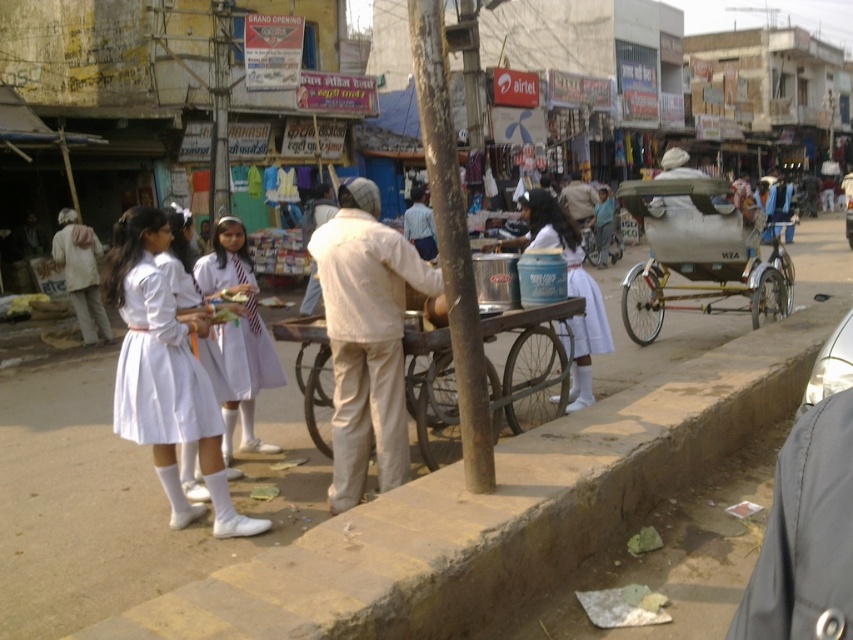
You are a customer at the market and want to buy a dress. You see the metallic silver cart at center and the white fabric dress at center. Which object is located to the left of the other?

The metallic silver cart at center is positioned on the left side of white fabric dress at center.

You are a photographer standing at the edge of the street. You want to take a photo of the white uniform at center without the metallic silver cart at center appearing in the background. Is the cart currently positioned behind the uniform?

The metallic silver cart at center is behind the white uniform at center, so yes, the cart is currently positioned behind the uniform, which means it would appear in the background of the photo.

You are standing at the point marked by the coordinates point [239,332] in the image. What object are you directly facing?

The point [239,332] marks the white uniform at center, so you are directly facing the white uniform at center.